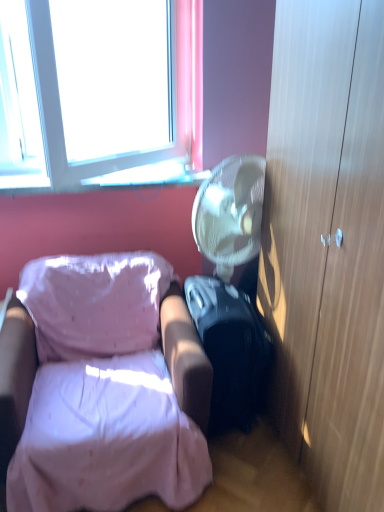
Question: From the image's perspective, does pink fabric chair at lower left appear lower than black matte suitcase at lower right?

Choices:
 (A) no
 (B) yes

Answer: (B)

Question: Is pink fabric chair at lower left not near black matte suitcase at lower right?

Choices:
 (A) yes
 (B) no

Answer: (B)

Question: From a real-world perspective, is pink fabric chair at lower left under black matte suitcase at lower right?

Choices:
 (A) yes
 (B) no

Answer: (B)

Question: Does pink fabric chair at lower left have a lesser height compared to black matte suitcase at lower right?

Choices:
 (A) no
 (B) yes

Answer: (A)

Question: From the image's perspective, is pink fabric chair at lower left over black matte suitcase at lower right?

Choices:
 (A) yes
 (B) no

Answer: (B)

Question: Is pink fabric chair at lower left turned away from black matte suitcase at lower right?

Choices:
 (A) yes
 (B) no

Answer: (B)

Question: Is transparent glass window sill at upper left at the back of wooden cabinet at right?

Choices:
 (A) yes
 (B) no

Answer: (B)

Question: Is wooden cabinet at right taller than transparent glass window sill at upper left?

Choices:
 (A) no
 (B) yes

Answer: (B)

Question: Does wooden cabinet at right have a lesser width compared to transparent glass window sill at upper left?

Choices:
 (A) yes
 (B) no

Answer: (B)

Question: Considering the relative positions of wooden cabinet at right and transparent glass window sill at upper left in the image provided, is wooden cabinet at right behind transparent glass window sill at upper left?

Choices:
 (A) no
 (B) yes

Answer: (A)

Question: Is wooden cabinet at right outside of transparent glass window sill at upper left?

Choices:
 (A) yes
 (B) no

Answer: (A)

Question: Is wooden cabinet at right bigger than transparent glass window sill at upper left?

Choices:
 (A) yes
 (B) no

Answer: (A)

Question: Considering the relative sizes of black matte suitcase at lower right and pink fabric chair at lower left in the image provided, is black matte suitcase at lower right wider than pink fabric chair at lower left?

Choices:
 (A) no
 (B) yes

Answer: (A)